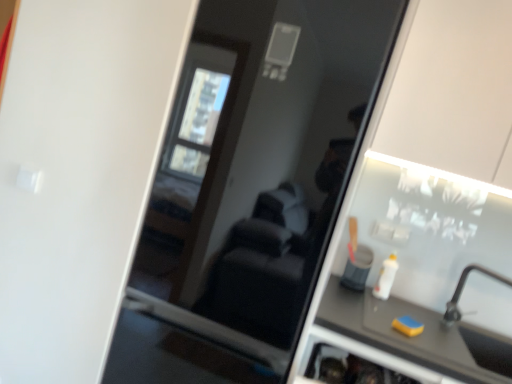
At what (x,y) coordinates should I click in order to perform the action: click on matte black counter top at lower right. Please return your answer as a coordinate pair (x, y). The width and height of the screenshot is (512, 384). Looking at the image, I should click on (403, 335).

Find the location of `transparent glass screen door at center`. transparent glass screen door at center is located at coordinates (251, 185).

Is transparent glass screen door at center not inside white plastic bottle at right?

Indeed, transparent glass screen door at center is completely outside white plastic bottle at right.

How different are the orientations of transparent glass screen door at center and white plastic bottle at right in degrees?

0.28 degrees separate the facing orientations of transparent glass screen door at center and white plastic bottle at right.

Between transparent glass screen door at center and white plastic bottle at right, which one has smaller size?

white plastic bottle at right is smaller.

Which is behind, point (216, 194) or point (385, 275)?

The point (216, 194) is farther from the camera.

Which object is positioned more to the left, white plastic bottle at right or transparent glass screen door at center?

From the viewer's perspective, transparent glass screen door at center appears more on the left side.

Considering the positions of points (386, 286) and (382, 1), is point (386, 286) closer to camera compared to point (382, 1)?

No, it is not.

Which of these two, white plastic bottle at right or transparent glass screen door at center, is smaller?

With smaller size is white plastic bottle at right.

Find the location of a particular element. Image resolution: width=512 pixels, height=384 pixels. screen door above the white plastic bottle at right (from the image's perspective) is located at coordinates (251, 185).

From a real-world perspective, is silver metallic faucet at lower right under matte black counter top at lower right?

No, from a real-world perspective, silver metallic faucet at lower right is not beneath matte black counter top at lower right.

Consider the image. Does silver metallic faucet at lower right have a greater height compared to matte black counter top at lower right?

Indeed, silver metallic faucet at lower right has a greater height compared to matte black counter top at lower right.

Can you confirm if silver metallic faucet at lower right is bigger than matte black counter top at lower right?

No.

Based on the photo, how many degrees apart are the facing directions of yellow sponge at lower right and transparent glass screen door at center?

The angular difference between yellow sponge at lower right and transparent glass screen door at center is 29.8 degrees.

Is yellow sponge at lower right completely or partially outside of transparent glass screen door at center?

Indeed, yellow sponge at lower right is completely outside transparent glass screen door at center.

Is yellow sponge at lower right beside transparent glass screen door at center?

There is a gap between yellow sponge at lower right and transparent glass screen door at center.

Is the position of yellow sponge at lower right more distant than that of transparent glass screen door at center?

Yes, it is behind transparent glass screen door at center.

Is silver metallic faucet at lower right situated inside white plastic bottle at right or outside?

silver metallic faucet at lower right exists outside the volume of white plastic bottle at right.

Which object is wider, silver metallic faucet at lower right or white plastic bottle at right?

silver metallic faucet at lower right is wider.

Could you tell me if silver metallic faucet at lower right is facing white plastic bottle at right?

No, silver metallic faucet at lower right is not aimed at white plastic bottle at right.

From a real-world perspective, between silver metallic faucet at lower right and white plastic bottle at right, who is vertically higher?

In real-world perspective, silver metallic faucet at lower right is above.

From the picture: From a real-world perspective, between yellow sponge at lower right and matte black counter top at lower right, who is vertically higher?

yellow sponge at lower right is physically above.

Can you confirm if yellow sponge at lower right is wider than matte black counter top at lower right?

Incorrect, the width of yellow sponge at lower right does not surpass that of matte black counter top at lower right.

Does yellow sponge at lower right have a larger size compared to matte black counter top at lower right?

Actually, yellow sponge at lower right might be smaller than matte black counter top at lower right.

Can you tell me how much yellow sponge at lower right and matte black counter top at lower right differ in facing direction?

The angular difference between yellow sponge at lower right and matte black counter top at lower right is 29.9 degrees.

The width and height of the screenshot is (512, 384). What are the coordinates of `toiletry above the silver metallic faucet at lower right (from the image's perspective)` in the screenshot? It's located at (386, 278).

Are white plastic bottle at right and silver metallic faucet at lower right far apart?

No, white plastic bottle at right is not far from silver metallic faucet at lower right.

Considering the sizes of objects white plastic bottle at right and silver metallic faucet at lower right in the image provided, who is taller, white plastic bottle at right or silver metallic faucet at lower right?

With more height is silver metallic faucet at lower right.

From a real-world perspective, is white plastic bottle at right under silver metallic faucet at lower right?

Yes, from a real-world perspective, white plastic bottle at right is beneath silver metallic faucet at lower right.

Where is `screen door that appears above the white plastic bottle at right (from a real-world perspective)`? screen door that appears above the white plastic bottle at right (from a real-world perspective) is located at coordinates (251, 185).

Find the location of a particular element. toiletry lying on the right of transparent glass screen door at center is located at coordinates (386, 278).

Looking at the image, which one is located further to yellow sponge at lower right, transparent glass screen door at center or white plastic bottle at right?

transparent glass screen door at center.

Considering their positions, is matte black counter top at lower right positioned further to silver metallic faucet at lower right than transparent glass screen door at center?

transparent glass screen door at center is positioned further to the anchor silver metallic faucet at lower right.

From the image, which object appears to be farther from transparent glass screen door at center, white plastic bottle at right or matte black counter top at lower right?

white plastic bottle at right is positioned further to the anchor transparent glass screen door at center.

From the image, which object appears to be farther from white plastic bottle at right, yellow sponge at lower right or silver metallic faucet at lower right?

silver metallic faucet at lower right.

Looking at the image, which one is located further to matte black counter top at lower right, yellow sponge at lower right or transparent glass screen door at center?

The object further to matte black counter top at lower right is transparent glass screen door at center.

Based on their spatial positions, is transparent glass screen door at center or yellow sponge at lower right closer to matte black counter top at lower right?

yellow sponge at lower right is closer to matte black counter top at lower right.

Based on their spatial positions, is transparent glass screen door at center or yellow sponge at lower right further from silver metallic faucet at lower right?

transparent glass screen door at center.

From the picture: Based on their spatial positions, is transparent glass screen door at center or silver metallic faucet at lower right closer to white plastic bottle at right?

silver metallic faucet at lower right is closer to white plastic bottle at right.

Locate an element on the screen. This screenshot has height=384, width=512. toiletry between yellow sponge at lower right and silver metallic faucet at lower right from left to right is located at coordinates (386, 278).

What are the coordinates of `counter top between transparent glass screen door at center and silver metallic faucet at lower right in the horizontal direction` in the screenshot? It's located at (403, 335).

Where is `soap between transparent glass screen door at center and matte black counter top at lower right in the horizontal direction`? The height and width of the screenshot is (384, 512). soap between transparent glass screen door at center and matte black counter top at lower right in the horizontal direction is located at coordinates (408, 326).

Locate an element on the screen. The image size is (512, 384). counter top between yellow sponge at lower right and silver metallic faucet at lower right is located at coordinates (403, 335).